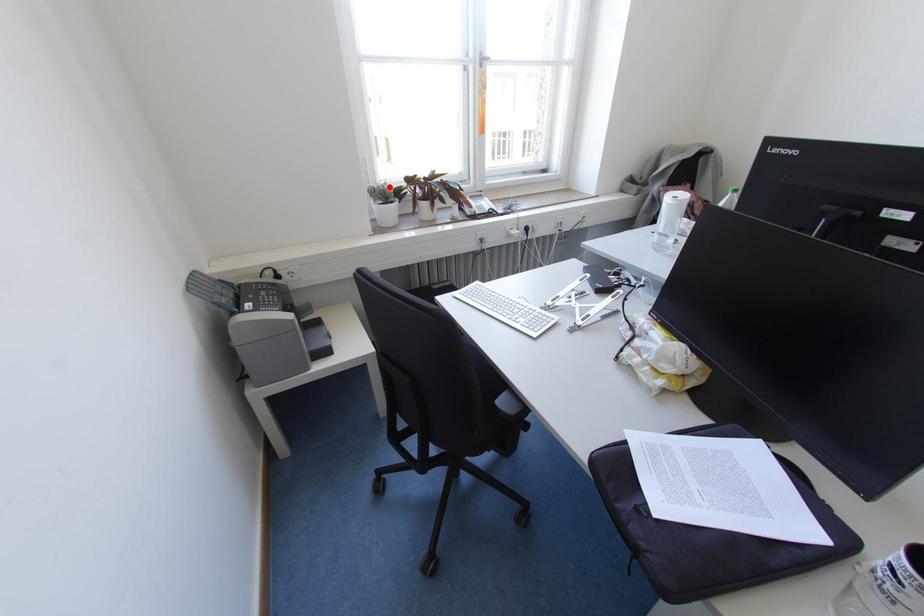
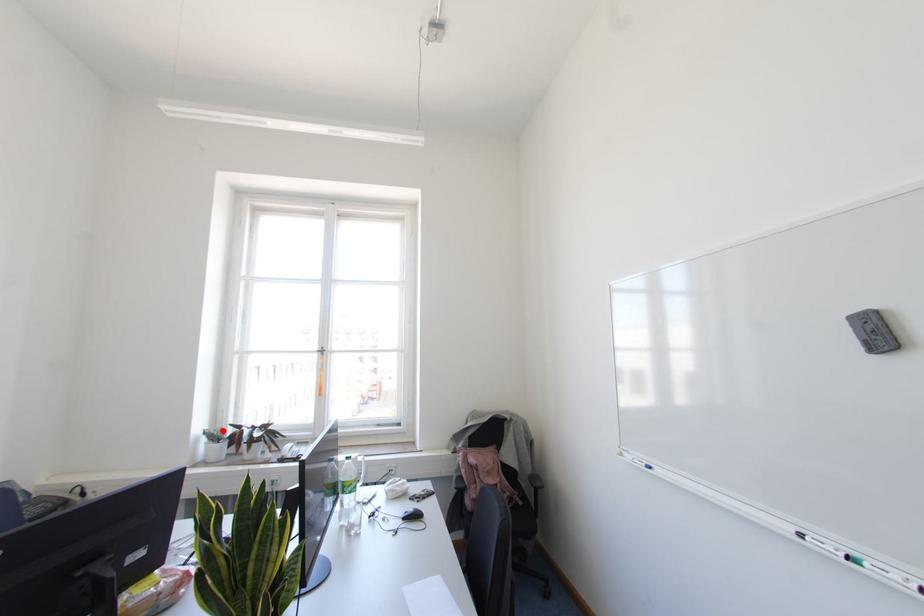
I am providing you with two images of the same scene from different viewpoints. A red point is marked on the first image and another point is marked on the second image. Does the point marked in image1 correspond to the same location as the one in image2?

Yes